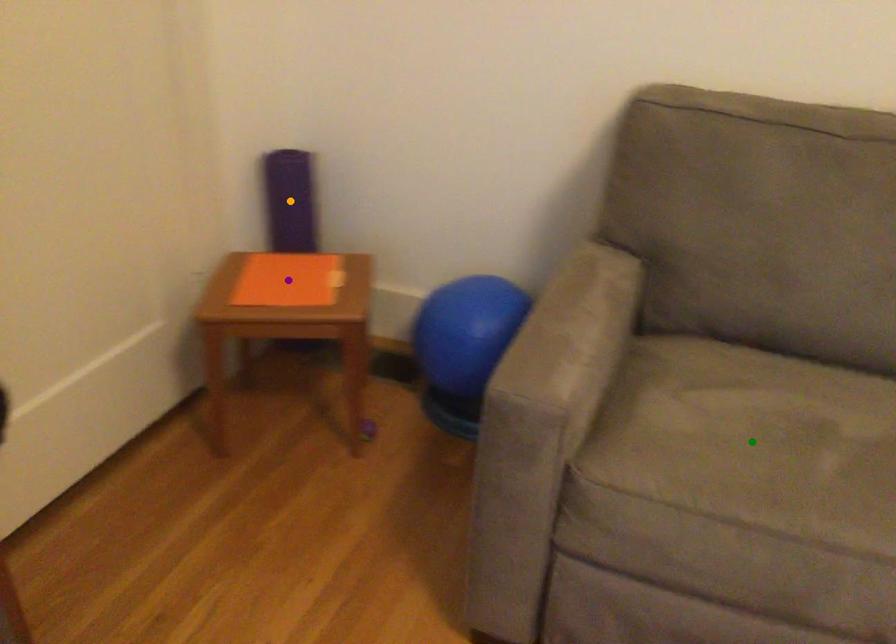
Order these from nearest to farthest:
orange point
purple point
green point

1. green point
2. purple point
3. orange point